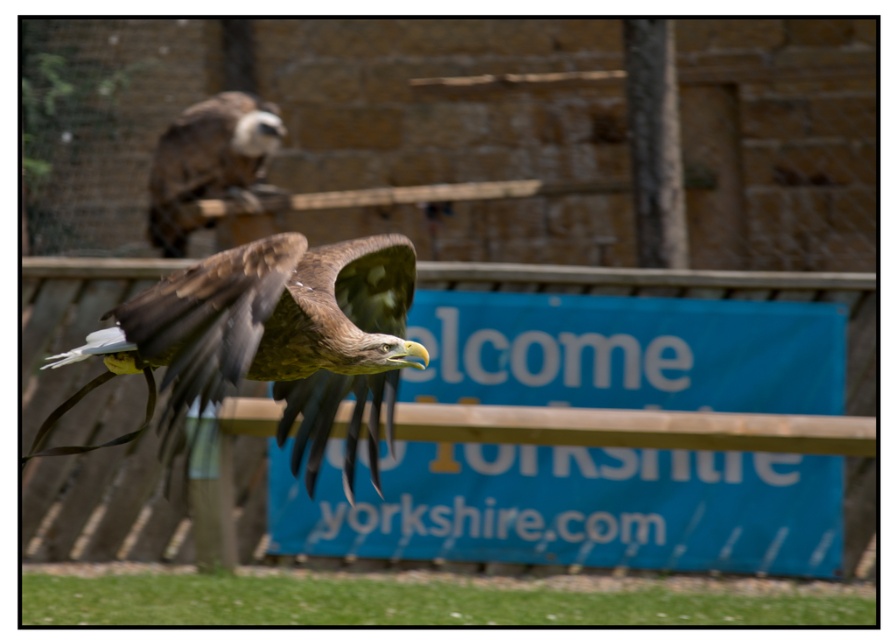
You are a photographer trying to capture the brown feathered eagle at center and the brown feathered eagle at upper center in a single shot. Which eagle should you adjust your camera to focus on first to ensure both are in frame?

The brown feathered eagle at upper center should be focused on first since the brown feathered eagle at center is to the right of it, allowing you to adjust the frame to include both.

What is located at the point with coordinates [269,337] in the image?

The point at coordinates [269,337] is where the brown feathered eagle at center is located.